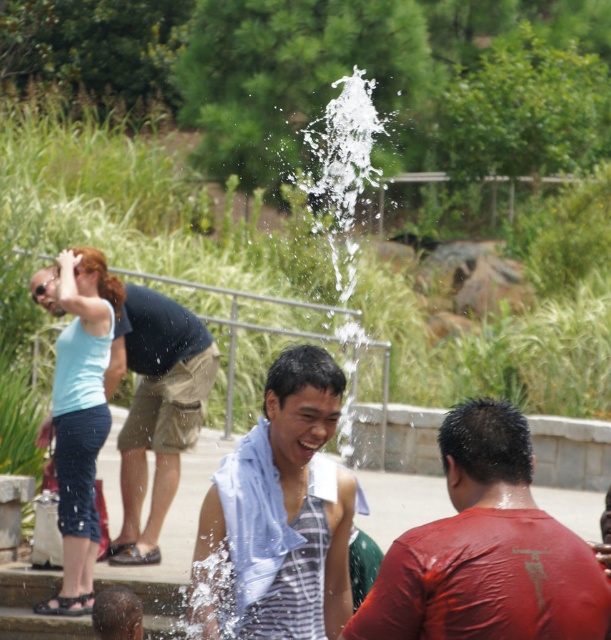
Question: Among these points, which one is farthest from the camera?

Choices:
 (A) (169, 404)
 (B) (469, 406)
 (C) (321, 576)

Answer: (A)

Question: Which object is closer to the camera taking this photo?

Choices:
 (A) matte red shirt at center
 (B) striped sleeveless shirt at center
 (C) matte black shirt at upper left

Answer: (A)

Question: Where is striped sleeveless shirt at center located in relation to matte black shirt at upper left in the image?

Choices:
 (A) below
 (B) above

Answer: (A)

Question: From the image, what is the correct spatial relationship of matte red shirt at center in relation to striped sleeveless shirt at center?

Choices:
 (A) below
 (B) above

Answer: (B)

Question: Does striped sleeveless shirt at center appear on the right side of matte black shirt at upper left?

Choices:
 (A) no
 (B) yes

Answer: (B)

Question: Which object is the farthest from the matte black shirt at upper left?

Choices:
 (A) matte red shirt at center
 (B) striped sleeveless shirt at center

Answer: (A)